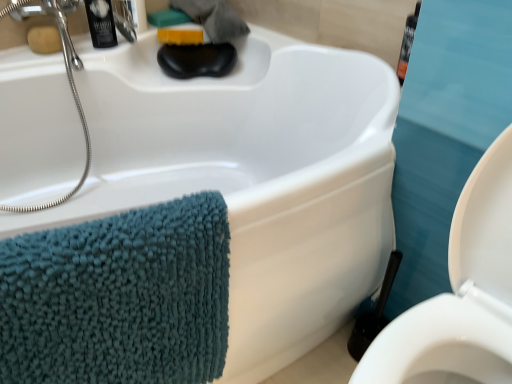
Question: Is black plastic toiletry at upper left bigger or smaller than black plastic toilet brush at lower right?

Choices:
 (A) big
 (B) small

Answer: (B)

Question: From the image's perspective, is black plastic toiletry at upper left above or below black plastic toilet brush at lower right?

Choices:
 (A) above
 (B) below

Answer: (A)

Question: Which of these objects is positioned closest to the satin nickel faucet at upper left?

Choices:
 (A) yellow sponge at upper center, which is counted as the second soap, starting from the left
 (B) matte brown soap at upper left, the first soap when ordered from left to right
 (C) black plastic toiletry at upper left
 (D) black plastic toilet brush at lower right
 (E) teal chenille towel at left

Answer: (C)

Question: Estimate the real-world distances between objects in this image. Which object is farther from the yellow sponge at upper center, which is the first soap from back to front?

Choices:
 (A) satin nickel faucet at upper left
 (B) black plastic toiletry at upper left
 (C) white glossy toilet at lower right
 (D) matte brown soap at upper left, which is counted as the 2th soap, starting from the right
 (E) black plastic toilet brush at lower right

Answer: (C)